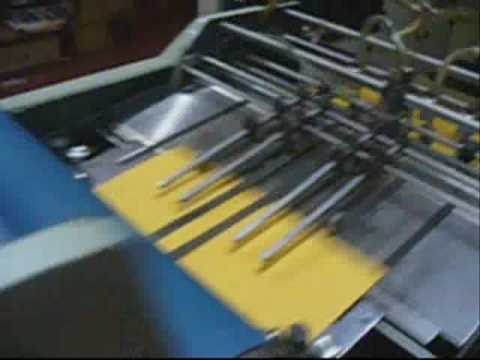
Locate an element on the screen. rod is located at coordinates (233, 164).